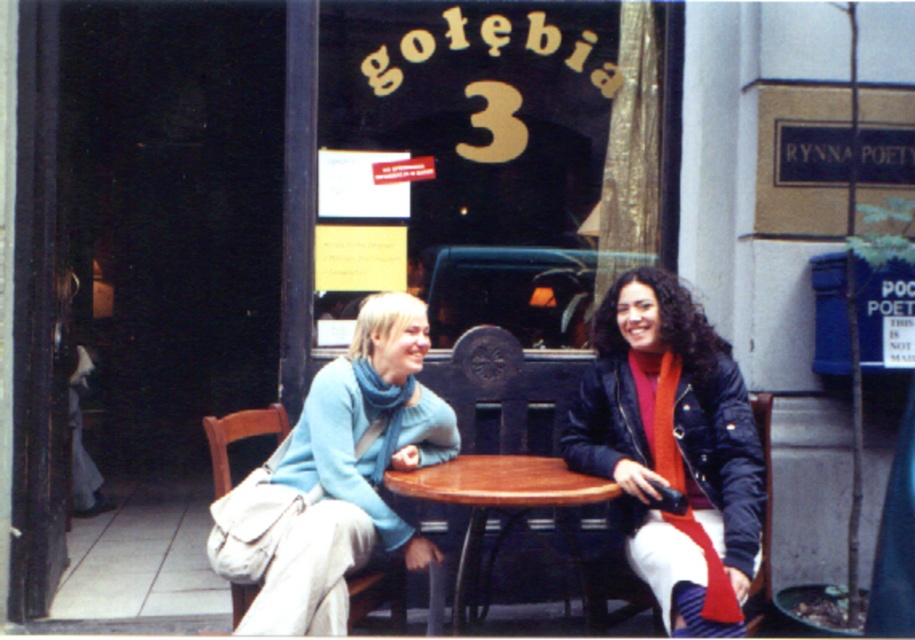
You are a fashion designer observing two people at a round table in a sunny outdoor area. You need to decide which garment to recommend for a petite frame. Which item would you suggest between the matte black jacket at center and the light blue sweater at center?

The matte black jacket at center has a smaller size compared to the light blue sweater at center, so it would be more suitable for someone with a petite frame.

You are a photographer trying to capture a candid shot of the two people at the round table. Since you want to focus on the person in the light blue sweater at center, where should you position yourself relative to the matte black jacket at center?

You should position yourself to the left of the matte black jacket at center because the light blue sweater at center is on the left side of the matte black jacket at center.

You are standing at the entrance of the cafe and want to find the person wearing the light blue sweater at center. Based on their position relative to the entrance, can you determine if they are seated to the left or right side of the table?

The light blue sweater at center is located at point (351, 472) in coordinates, which places them to the right side of the table relative to the entrance.